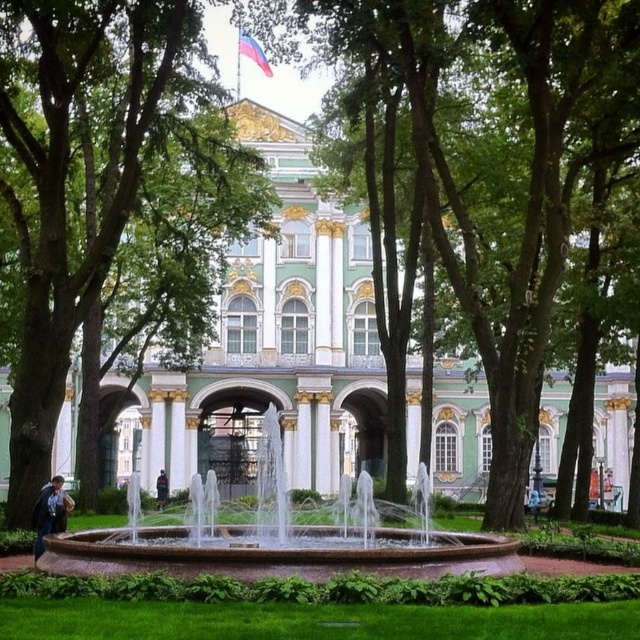
You are standing in front of the grand building and want to take a photo that includes both the circular fountain and the arched doorways. Which of the two points, point (19, 417) or point (417, 410), is closer to you and should be prioritized in your composition to ensure both elements are in focus?

Point (19, 417) is closer to the viewer than point (417, 410), so prioritizing this point in your composition will help ensure both the circular fountain and arched doorways are in focus.

You are standing in front of the grand building and see the green leafy tree at center and the dark blue jacket at center. Which object is positioned to the left when facing the building?

The green leafy tree at center is to the left of the dark blue jacket at center when facing the building.